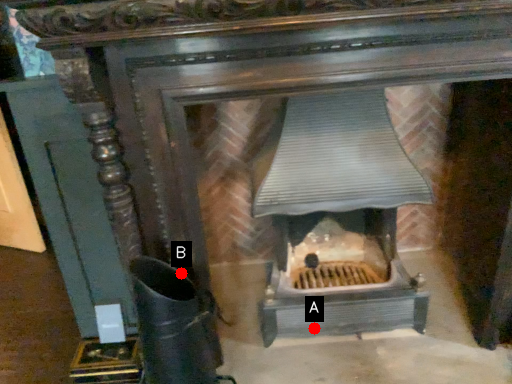
Question: Two points are circled on the image, labeled by A and B beside each circle. Which point is closer to the camera?

Choices:
 (A) A is closer
 (B) B is closer

Answer: (B)